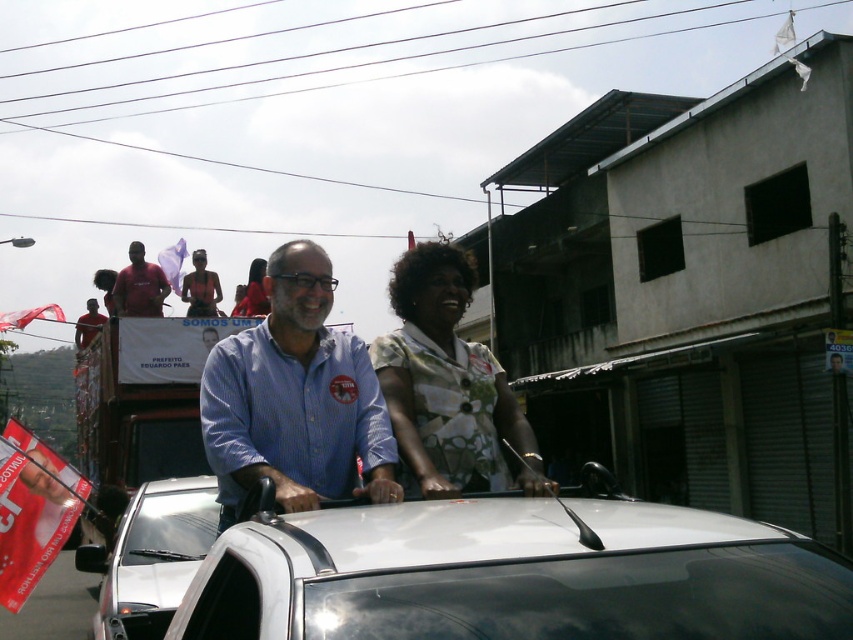
Question: Estimate the real-world distances between objects in this image. Which object is closer to the white glossy car at center?

Choices:
 (A) floral fabric blouse at center
 (B) matte black shirt at center

Answer: (A)

Question: Which point is closer to the camera?

Choices:
 (A) matte red shirt at upper left
 (B) white glossy car at center
 (C) matte black shirt at center
 (D) silver metallic car at center

Answer: (B)

Question: Which point is closer to the camera taking this photo?

Choices:
 (A) (199, 282)
 (B) (143, 502)
 (C) (460, 346)

Answer: (C)

Question: Can you confirm if blue button-down shirt at center is wider than silver metallic car at center?

Choices:
 (A) yes
 (B) no

Answer: (A)

Question: Is blue button-down shirt at center positioned in front of matte red shirt at upper left?

Choices:
 (A) no
 (B) yes

Answer: (B)

Question: Does blue button-down shirt at center appear under matte red shirt at upper left?

Choices:
 (A) yes
 (B) no

Answer: (A)